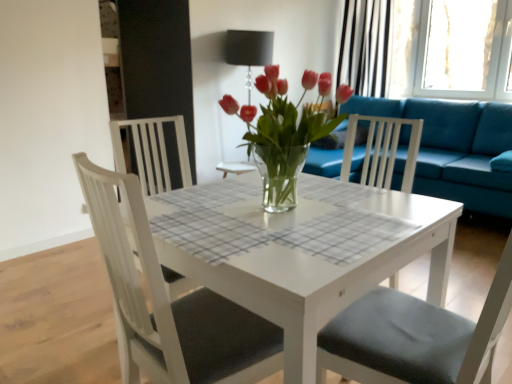
You are a GUI agent. You are given a task and a screenshot of the screen. Output one action in this format:
    pyautogui.click(x=<x>, y=<y>)
    Task: Click on the vacant space underneath clear glass vase at center (from a real-world perspective)
    Image resolution: width=512 pixels, height=384 pixels.
    Given the screenshot: What is the action you would take?
    pyautogui.click(x=276, y=209)